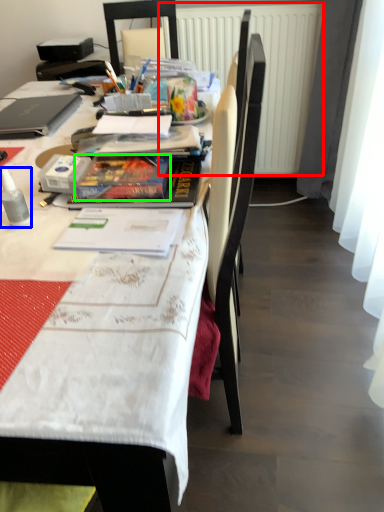
Question: Which object is the farthest from radiator (highlighted by a red box)? Choose among these: bottle (highlighted by a blue box) or paperback book (highlighted by a green box).

Choices:
 (A) bottle
 (B) paperback book

Answer: (A)